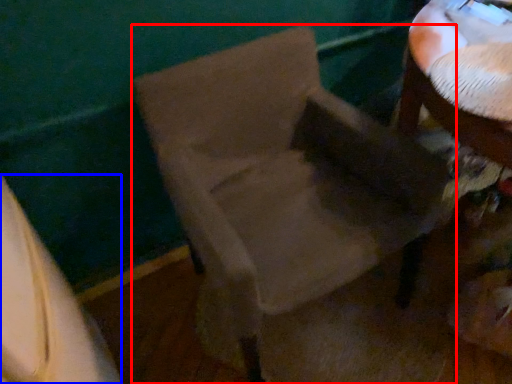
Question: Which of the following is the farthest to the observer, chair (highlighted by a red box) or leftover (highlighted by a blue box)?

Choices:
 (A) chair
 (B) leftover

Answer: (A)